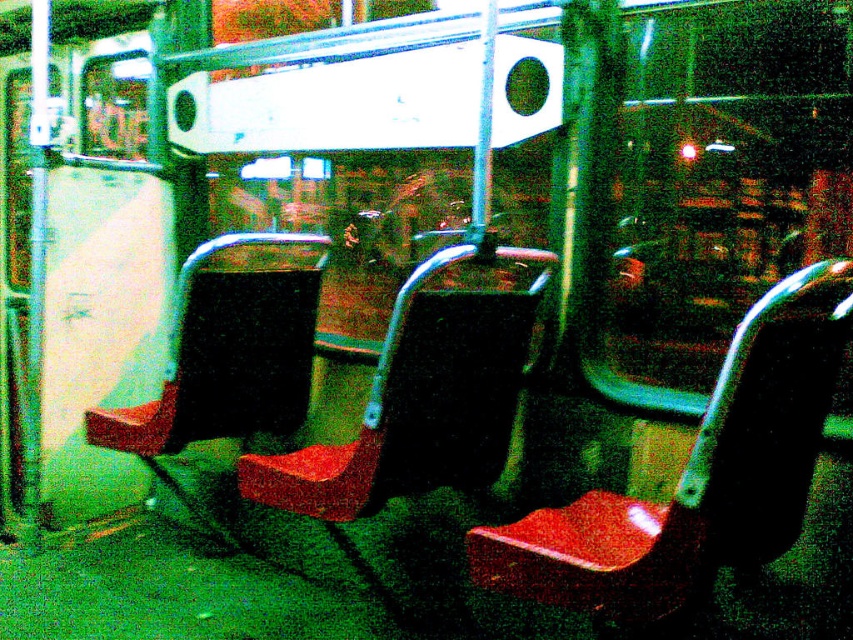
Question: Where is matte plastic chair at center located in relation to matte black seat at left in the image?

Choices:
 (A) below
 (B) above

Answer: (A)

Question: Estimate the real-world distances between objects in this image. Which object is farther from the matte plastic chair at center?

Choices:
 (A) matte red seat at center
 (B) matte black seat at left

Answer: (B)

Question: Which object is positioned closest to the matte plastic chair at center?

Choices:
 (A) matte black seat at left
 (B) matte red seat at center

Answer: (B)

Question: Which object is closer to the camera taking this photo?

Choices:
 (A) matte plastic chair at center
 (B) matte red seat at center
 (C) matte black seat at left

Answer: (A)

Question: Does matte plastic chair at center come behind matte black seat at left?

Choices:
 (A) no
 (B) yes

Answer: (A)

Question: Is matte plastic chair at center thinner than matte red seat at center?

Choices:
 (A) no
 (B) yes

Answer: (B)